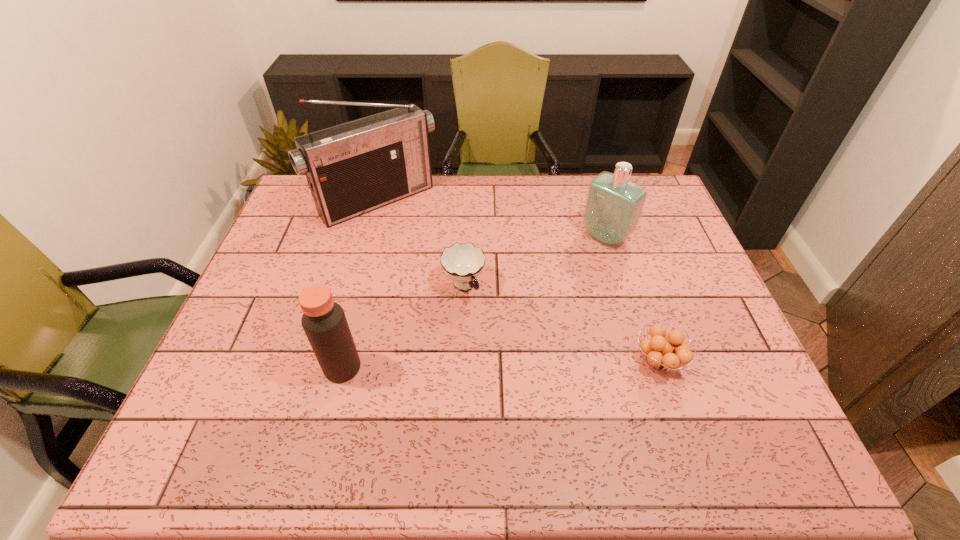
Identify the location of free space on the desktop that is between the vinegar and the orange fruit and is positioned on the side of the third object from left to right with the handle. (516, 364).

Where is `free spot on the desktop that is between the vinegar and the orange fruit and is positioned on the front-facing side of the radio receiver`? The width and height of the screenshot is (960, 540). free spot on the desktop that is between the vinegar and the orange fruit and is positioned on the front-facing side of the radio receiver is located at coordinates (525, 364).

You are a GUI agent. You are given a task and a screenshot of the screen. Output one action in this format:
    pyautogui.click(x=<x>, y=<y>)
    Task: Click on the free space on the desktop that is between the vinegar and the orange fruit and is positioned on the front label of the perfume
    The height and width of the screenshot is (540, 960).
    Given the screenshot: What is the action you would take?
    pyautogui.click(x=463, y=365)